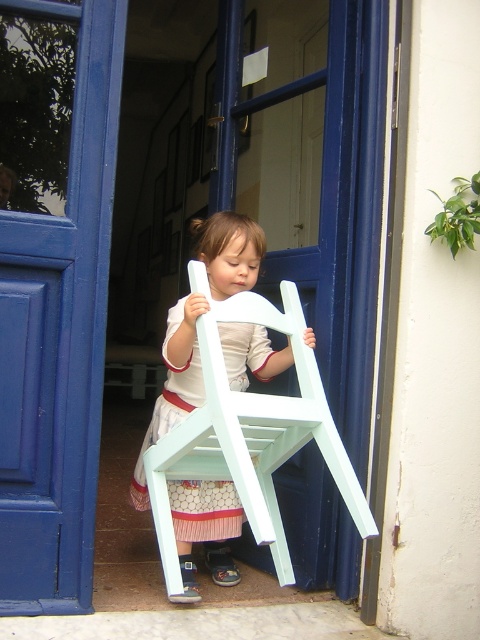
Is point (60, 500) more distant than point (172, 600)?

No, (60, 500) is closer to viewer.

Does point (105, 230) come in front of point (196, 230)?

That is True.

Measure the distance between point (21, 298) and camera.

A distance of 1.50 meters exists between point (21, 298) and camera.

Locate an element on the screen. blue wooden door at center is located at coordinates (59, 339).